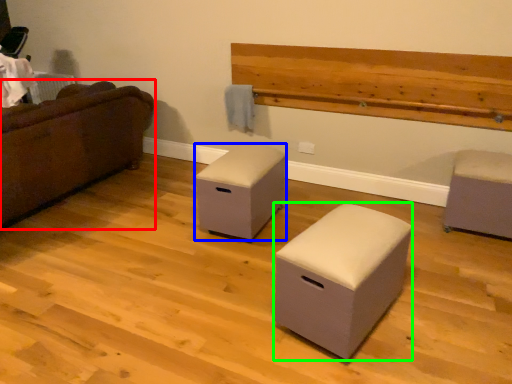
Question: Which object is the closest to the studio couch (highlighted by a red box)? Choose among these: furniture (highlighted by a blue box) or furniture (highlighted by a green box).

Choices:
 (A) furniture
 (B) furniture

Answer: (A)